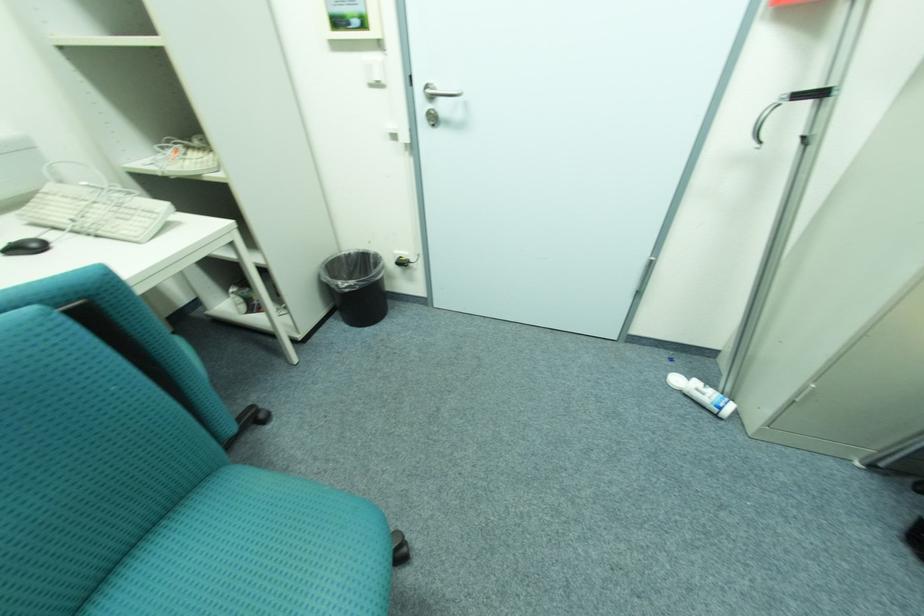
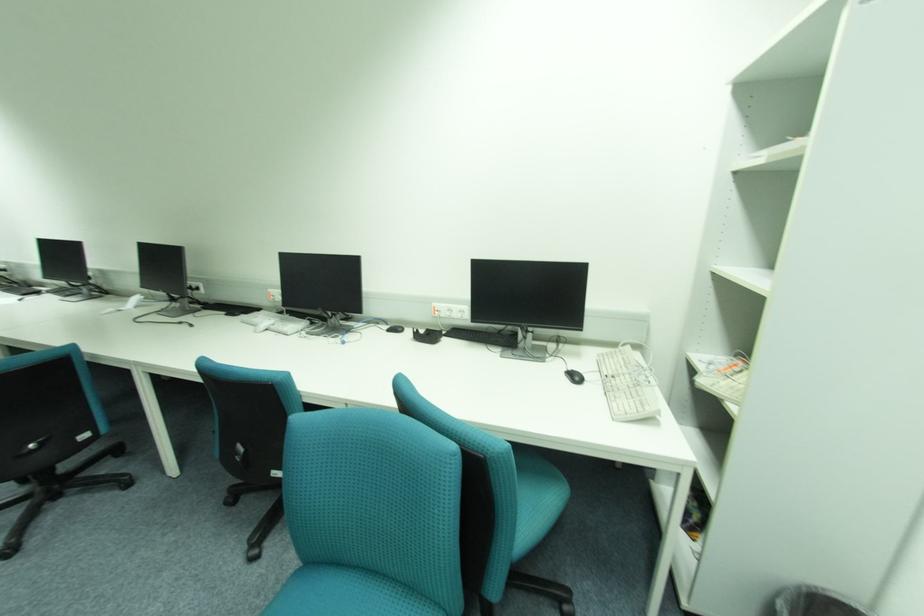
Where in the second image is the point corresponding to (x=43, y=246) from the first image?

(584, 379)